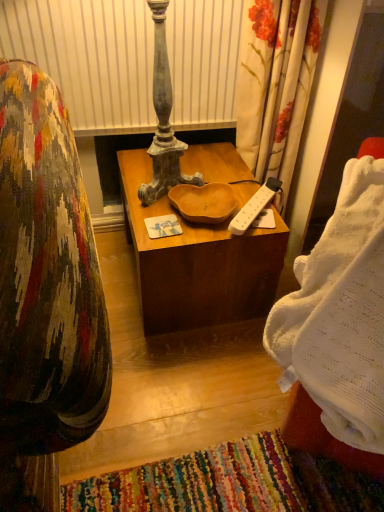
Question: Should I look upward or downward to see wooden at center?

Choices:
 (A) up
 (B) down

Answer: (A)

Question: Is wooden at center at the right side of white plastic power strip at center?

Choices:
 (A) yes
 (B) no

Answer: (B)

Question: Is wooden at center further to the viewer compared to white plastic power strip at center?

Choices:
 (A) yes
 (B) no

Answer: (B)

Question: Can you confirm if wooden at center is taller than white plastic power strip at center?

Choices:
 (A) no
 (B) yes

Answer: (B)

Question: Is wooden at center closer to camera compared to white plastic power strip at center?

Choices:
 (A) no
 (B) yes

Answer: (B)

Question: From a real-world perspective, is wooden at center positioned under white plastic power strip at center based on gravity?

Choices:
 (A) yes
 (B) no

Answer: (A)

Question: Would you say white plastic power strip at center is part of wooden at center's contents?

Choices:
 (A) no
 (B) yes

Answer: (A)

Question: Can you confirm if white plastic power strip at center is positioned to the right of white knitted blanket at right?

Choices:
 (A) yes
 (B) no

Answer: (B)

Question: Is white plastic power strip at center positioned far away from white knitted blanket at right?

Choices:
 (A) no
 (B) yes

Answer: (A)

Question: Considering the relative sizes of white plastic power strip at center and white knitted blanket at right in the image provided, is white plastic power strip at center thinner than white knitted blanket at right?

Choices:
 (A) no
 (B) yes

Answer: (B)

Question: From a real-world perspective, is white plastic power strip at center positioned under white knitted blanket at right based on gravity?

Choices:
 (A) no
 (B) yes

Answer: (B)

Question: Can white knitted blanket at right be found inside white plastic power strip at center?

Choices:
 (A) no
 (B) yes

Answer: (A)

Question: Considering the relative sizes of white plastic power strip at center and white knitted blanket at right in the image provided, is white plastic power strip at center smaller than white knitted blanket at right?

Choices:
 (A) yes
 (B) no

Answer: (A)

Question: Is white plastic power strip at center oriented away from wooden at center?

Choices:
 (A) yes
 (B) no

Answer: (B)